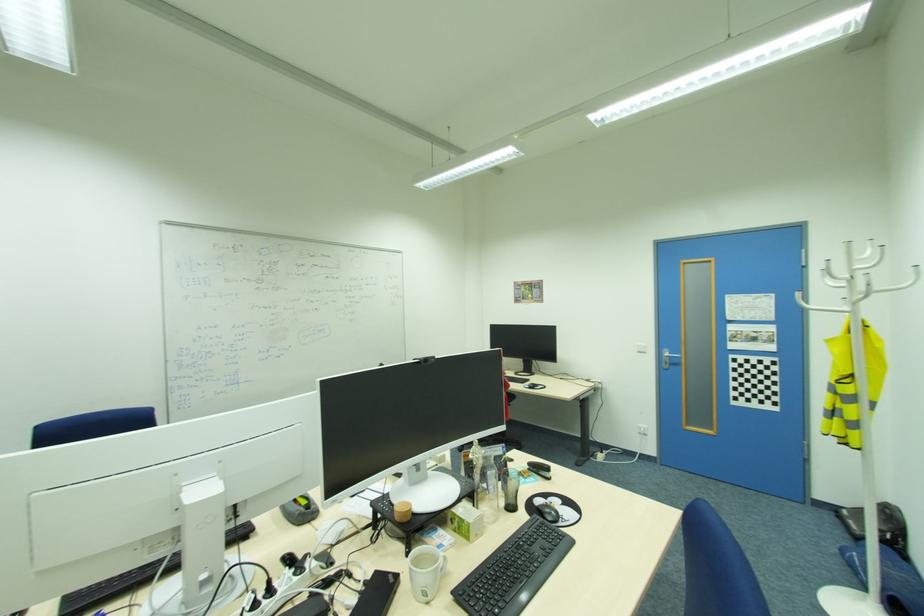
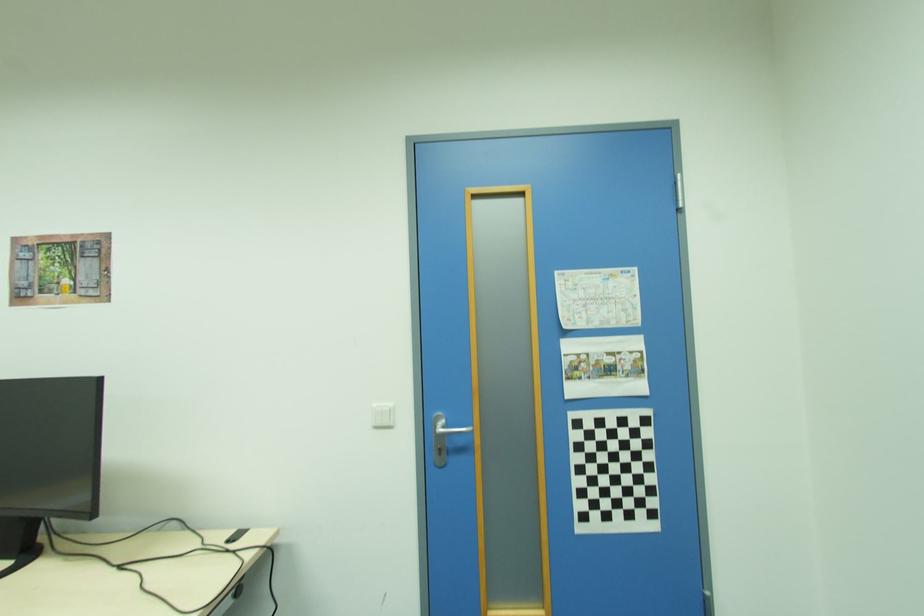
In the second image, find the point that corresponds to the point at 737,337 in the first image.

(579, 369)